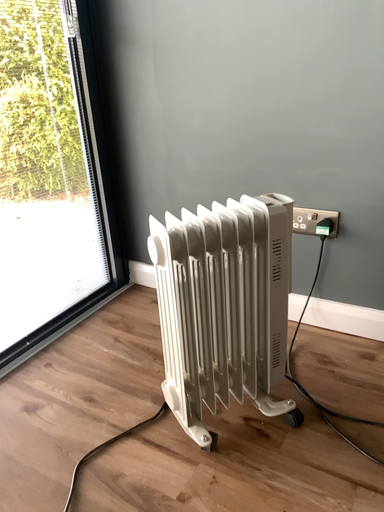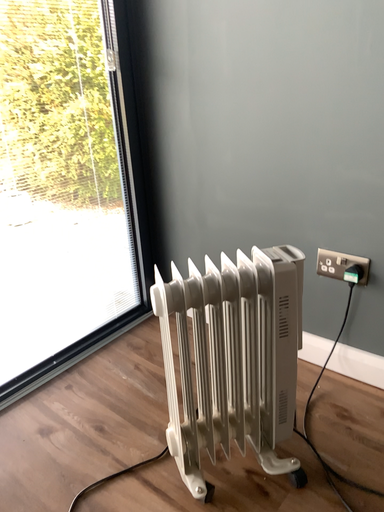
Question: Which way did the camera rotate in the video?

Choices:
 (A) rotated right
 (B) rotated left

Answer: (B)